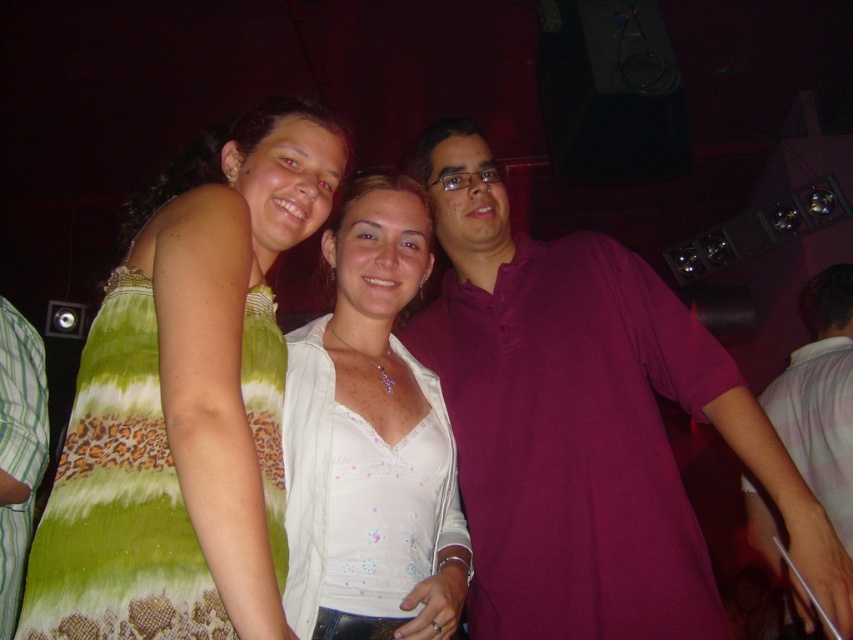
Question: Is green tie-dye dress at center to the left of purple cotton shirt at right from the viewer's perspective?

Choices:
 (A) no
 (B) yes

Answer: (B)

Question: Observing the image, what is the correct spatial positioning of purple cotton shirt at center in reference to white lace top at center?

Choices:
 (A) below
 (B) above

Answer: (A)

Question: Which is farther from the purple cotton shirt at center?

Choices:
 (A) purple cotton shirt at right
 (B) green tie-dye dress at center
 (C) white lace top at center
 (D) green striped shirt at left

Answer: (A)

Question: Which point is farther to the camera?

Choices:
 (A) (387, 253)
 (B) (13, 579)
 (C) (633, 387)
 (D) (821, 276)

Answer: (D)

Question: Based on their relative distances, which object is nearer to the white lace top at center?

Choices:
 (A) green tie-dye dress at center
 (B) purple cotton shirt at right
 (C) purple cotton shirt at center
 (D) green striped shirt at left

Answer: (C)

Question: Is white lace top at center to the left of purple cotton shirt at right from the viewer's perspective?

Choices:
 (A) no
 (B) yes

Answer: (B)